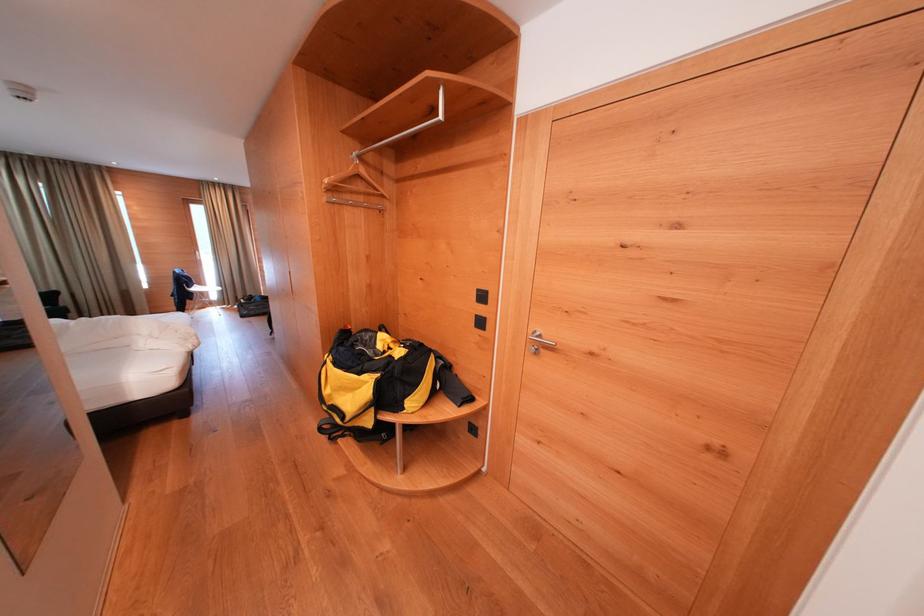
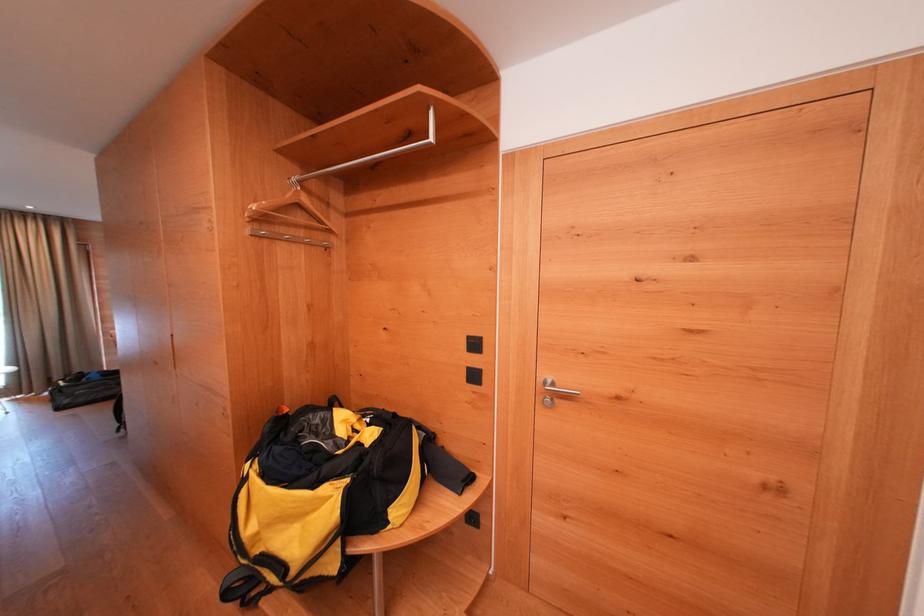
The point at (538, 336) is marked in the first image. Where is the corresponding point in the second image?

(546, 385)